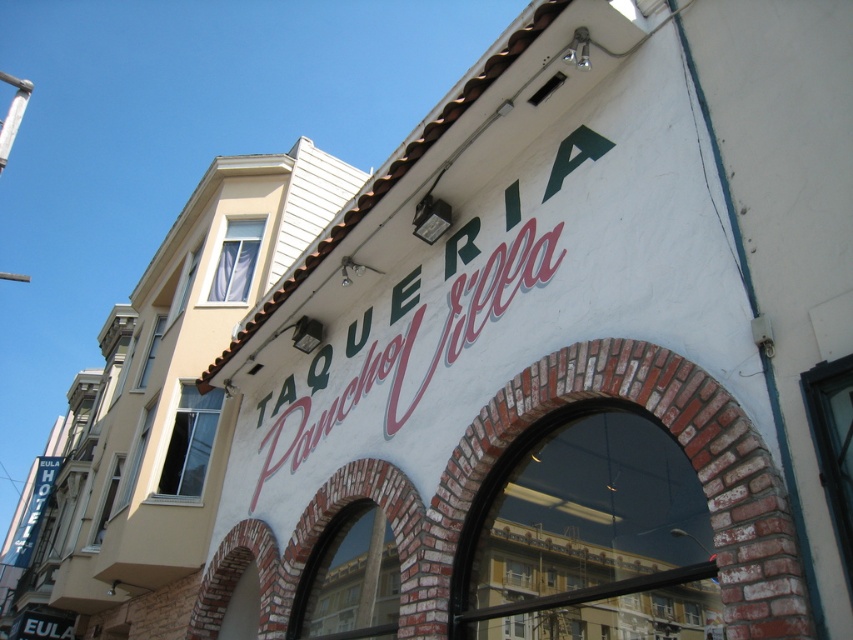
Does green painted sign at upper center have a larger size compared to blue fabric hotel sign at left?

No.

From the picture: Which of these two, green painted sign at upper center or blue fabric hotel sign at left, stands shorter?

green painted sign at upper center is shorter.

Between point (292, 428) and point (24, 518), which one is positioned in front?

Point (292, 428)

Find the location of a particular element. green painted sign at upper center is located at coordinates (410, 346).